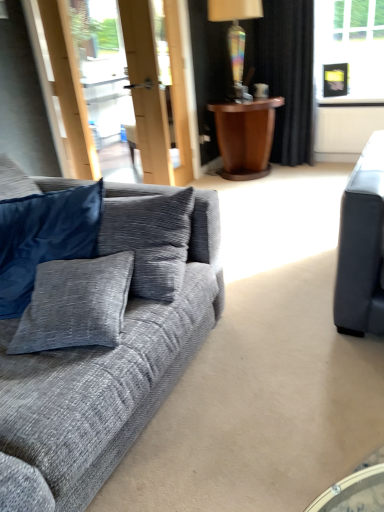
Question: Is rainbow glass lamp at upper center a part of textured gray couch at left?

Choices:
 (A) yes
 (B) no

Answer: (B)

Question: Is textured gray couch at left taller than rainbow glass lamp at upper center?

Choices:
 (A) yes
 (B) no

Answer: (A)

Question: From a real-world perspective, is textured gray couch at left below rainbow glass lamp at upper center?

Choices:
 (A) no
 (B) yes

Answer: (B)

Question: Does textured gray couch at left have a larger size compared to rainbow glass lamp at upper center?

Choices:
 (A) no
 (B) yes

Answer: (B)

Question: From the image's perspective, is textured gray couch at left on rainbow glass lamp at upper center?

Choices:
 (A) yes
 (B) no

Answer: (B)

Question: Is textured gray couch at left bigger or smaller than black velvet curtain at upper right?

Choices:
 (A) big
 (B) small

Answer: (A)

Question: Is textured gray couch at left spatially inside black velvet curtain at upper right, or outside of it?

Choices:
 (A) inside
 (B) outside

Answer: (B)

Question: From a real-world perspective, is textured gray couch at left above or below black velvet curtain at upper right?

Choices:
 (A) above
 (B) below

Answer: (B)

Question: From the image's perspective, is textured gray couch at left positioned above or below black velvet curtain at upper right?

Choices:
 (A) below
 (B) above

Answer: (A)

Question: From the image's perspective, is rainbow glass lamp at upper center located above or below textured gray couch at left?

Choices:
 (A) above
 (B) below

Answer: (A)

Question: From a real-world perspective, is rainbow glass lamp at upper center physically located above or below textured gray couch at left?

Choices:
 (A) below
 (B) above

Answer: (B)

Question: Would you say rainbow glass lamp at upper center is to the left or to the right of textured gray couch at left in the picture?

Choices:
 (A) left
 (B) right

Answer: (B)

Question: In terms of width, does rainbow glass lamp at upper center look wider or thinner when compared to textured gray couch at left?

Choices:
 (A) thin
 (B) wide

Answer: (A)

Question: Based on their positions, is textured gray couch at left located to the left or right of rainbow glass lamp at upper center?

Choices:
 (A) right
 (B) left

Answer: (B)

Question: Considering the positions of point (19, 461) and point (235, 10), is point (19, 461) closer or farther from the camera than point (235, 10)?

Choices:
 (A) farther
 (B) closer

Answer: (B)